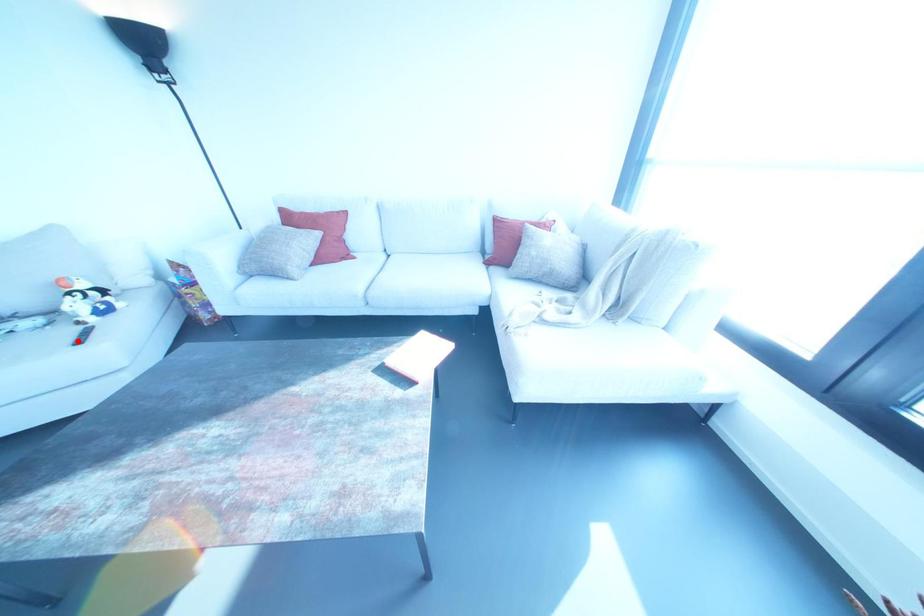
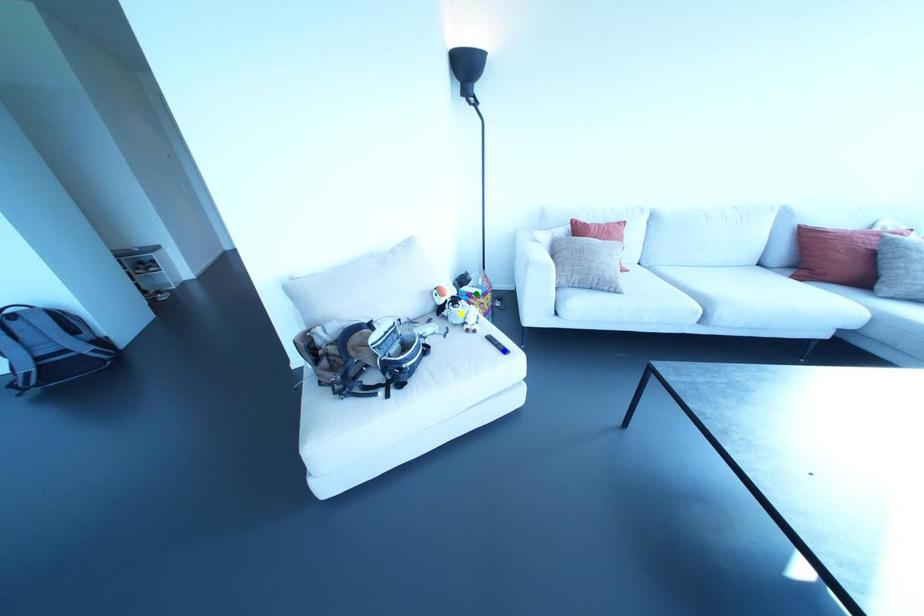
Question: I am providing you with two images of the same scene from different viewpoints. A red point is marked on the first image. You are given multiple points on the second image. Which point in image 2 represents the same 3d spot as the red point in image 1?

Choices:
 (A) green point
 (B) yellow point
 (C) blue point

Answer: (C)